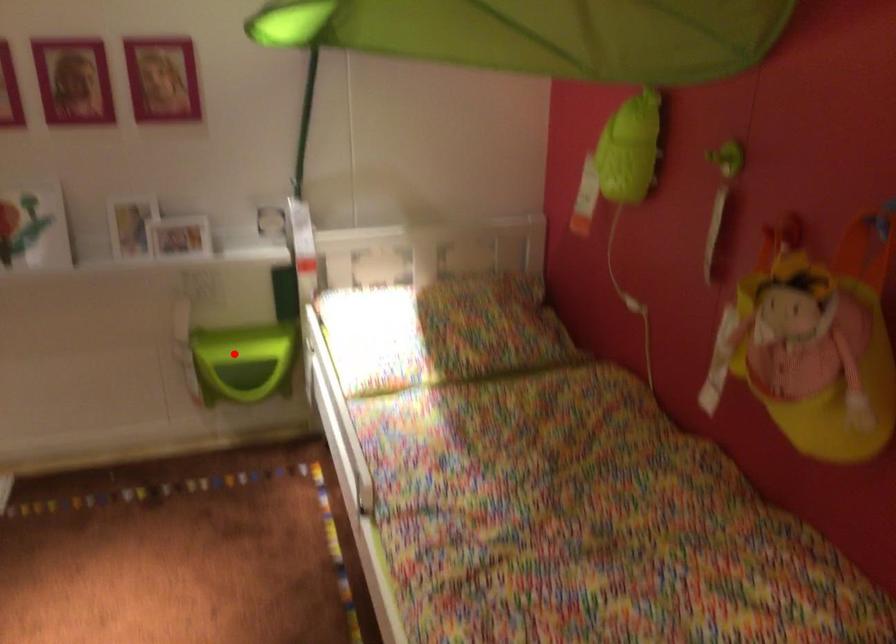
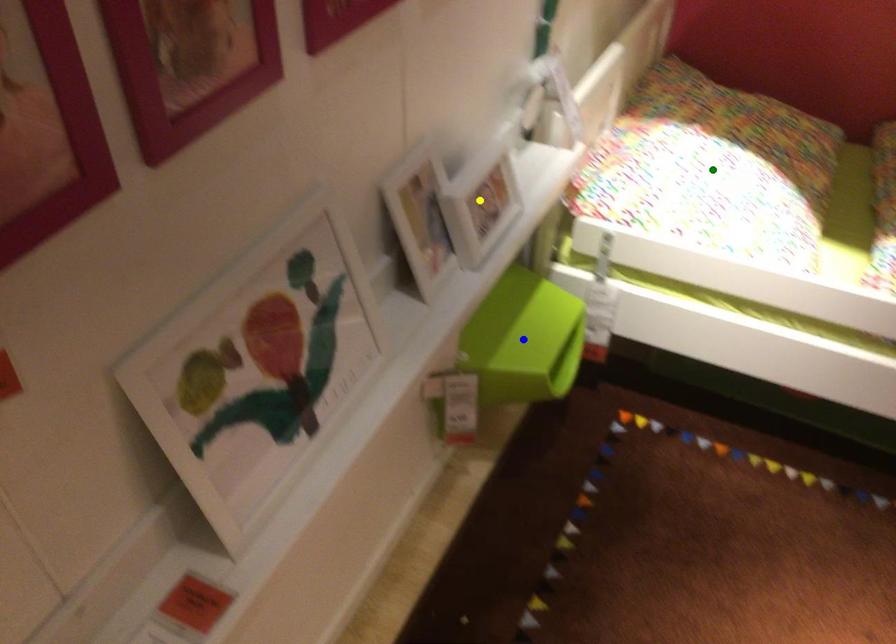
Question: I am providing you with two images of the same scene from different viewpoints. A red point is marked on the first image. You are given multiple points on the second image. Which point in image 2 is actually the same real-world point as the red point in image 1?

Choices:
 (A) green point
 (B) yellow point
 (C) blue point

Answer: (C)